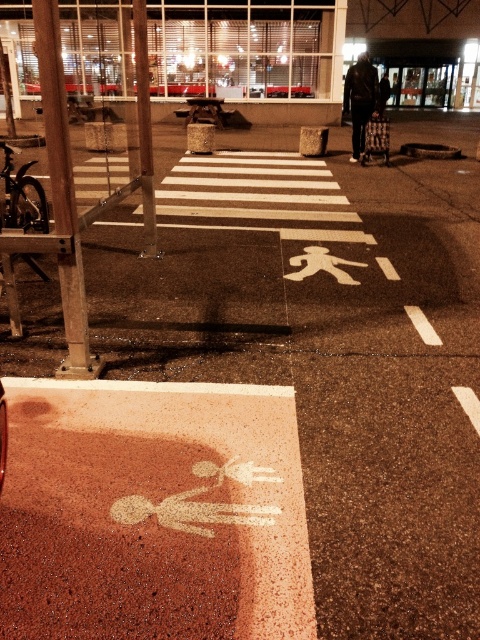
Question: Estimate the real-world distances between objects in this image. Which object is farther from the dark brown leather jacket at center?

Choices:
 (A) metallic pole at center
 (B) brushed metal pole at left

Answer: (B)

Question: Estimate the real-world distances between objects in this image. Which object is farther from the metallic pole at center?

Choices:
 (A) brushed metal pole at left
 (B) dark brown leather jacket at center

Answer: (B)

Question: Which point is farther to the camera?

Choices:
 (A) brushed metal pole at left
 (B) metallic pole at center
 (C) dark brown leather jacket at center

Answer: (C)

Question: Does metallic pole at center appear over dark brown leather jacket at center?

Choices:
 (A) no
 (B) yes

Answer: (A)

Question: Is metallic pole at center wider than dark brown leather jacket at center?

Choices:
 (A) yes
 (B) no

Answer: (B)

Question: Does metallic pole at center have a lesser width compared to dark brown leather jacket at center?

Choices:
 (A) no
 (B) yes

Answer: (B)